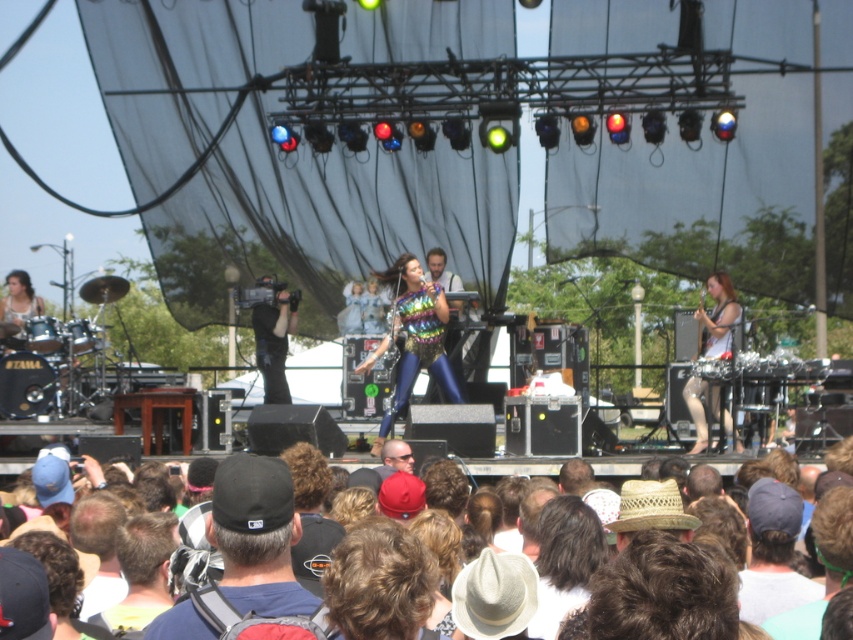
From the picture: Can you confirm if black fabric cap at center is positioned above metallic silver microphone at right?

Actually, black fabric cap at center is below metallic silver microphone at right.

Can you confirm if black fabric cap at center is taller than metallic silver microphone at right?

No.

At what (x,y) coordinates should I click in order to perform the action: click on black fabric cap at center. Please return your answer as a coordinate pair (x, y). Image resolution: width=853 pixels, height=640 pixels. Looking at the image, I should click on (257, 536).

This screenshot has height=640, width=853. Identify the location of black fabric cap at center. (257, 536).

Does brown hair at center appear over metallic silver microphone at right?

Actually, brown hair at center is below metallic silver microphone at right.

Who is positioned more to the left, brown hair at center or metallic silver microphone at right?

brown hair at center

Does point (759, 536) lie behind point (714, 320)?

No, (759, 536) is in front of (714, 320).

Where is `brown hair at center`? This screenshot has height=640, width=853. brown hair at center is located at coordinates (775, 509).

Who is more forward, (302, 608) or (828, 513)?

Positioned in front is point (302, 608).

Is point (218, 538) farther from camera compared to point (770, 502)?

No, it is in front of (770, 502).

Between point (228, 499) and point (801, 624), which one is positioned behind?

The point (228, 499) is more distant.

This screenshot has height=640, width=853. Identify the location of black fabric cap at center. (257, 536).